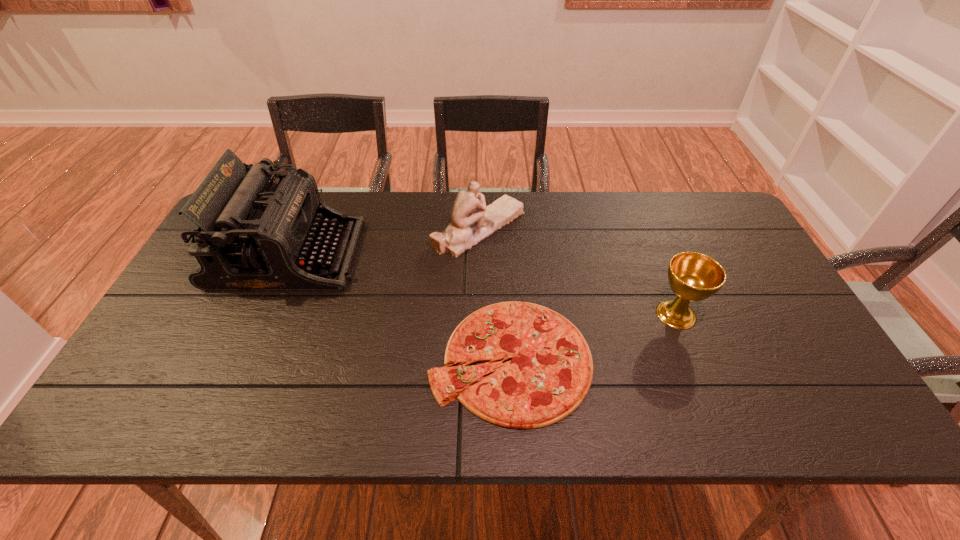
At what (x,y) coordinates should I click in order to perform the action: click on the second closest object to the shortest object. Please return your answer as a coordinate pair (x, y). The height and width of the screenshot is (540, 960). Looking at the image, I should click on (692, 276).

Image resolution: width=960 pixels, height=540 pixels. I want to click on free space in the image that satisfies the following two spatial constraints: 1. on the keyboard of the rightmost object; 2. on the left side of the typewriter, so click(x=262, y=314).

This screenshot has width=960, height=540. I want to click on vacant space that satisfies the following two spatial constraints: 1. on the front-facing side of the pizza; 2. on the right side of the figurine, so click(479, 359).

Identify the location of vacant point that satisfies the following two spatial constraints: 1. on the keyboard of the typewriter; 2. on the right side of the pizza. (243, 359).

Find the location of a particular element. This screenshot has height=540, width=960. vacant space that satisfies the following two spatial constraints: 1. on the front-facing side of the figurine; 2. on the left side of the pizza is located at coordinates (479, 359).

The width and height of the screenshot is (960, 540). I want to click on free space that satisfies the following two spatial constraints: 1. on the keyboard of the rightmost object; 2. on the left side of the typewriter, so click(262, 314).

Identify the location of vacant area that satisfies the following two spatial constraints: 1. on the back side of the pizza; 2. on the left side of the chalice. This screenshot has height=540, width=960. (508, 314).

In order to click on vacant space that satisfies the following two spatial constraints: 1. on the back side of the pizza; 2. on the keyboard of the tallest object in this screenshot , I will do [504, 254].

Find the location of a particular element. The height and width of the screenshot is (540, 960). blank area in the image that satisfies the following two spatial constraints: 1. on the front-facing side of the chalice; 2. on the right side of the figurine is located at coordinates (479, 314).

At what (x,y) coordinates should I click in order to perform the action: click on vacant space that satisfies the following two spatial constraints: 1. on the front-facing side of the rightmost object; 2. on the left side of the figurine. Please return your answer as a coordinate pair (x, y). This screenshot has width=960, height=540. Looking at the image, I should click on (479, 314).